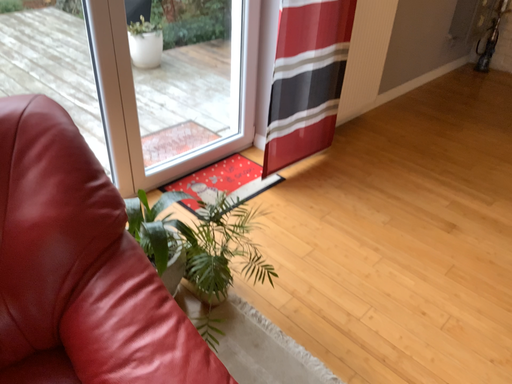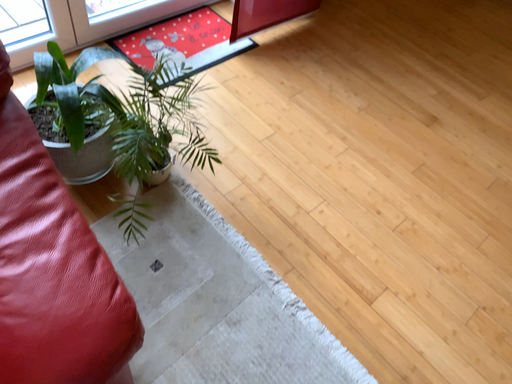
Question: Which way did the camera rotate in the video?

Choices:
 (A) rotated upward
 (B) rotated downward

Answer: (B)